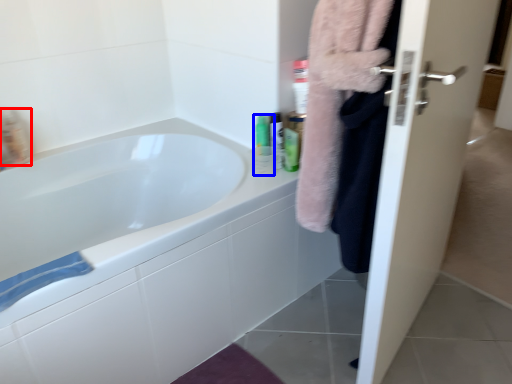
Question: Which point is closer to the camera, mouthwash (highlighted by a red box) or mouthwash (highlighted by a blue box)?

Choices:
 (A) mouthwash
 (B) mouthwash

Answer: (B)